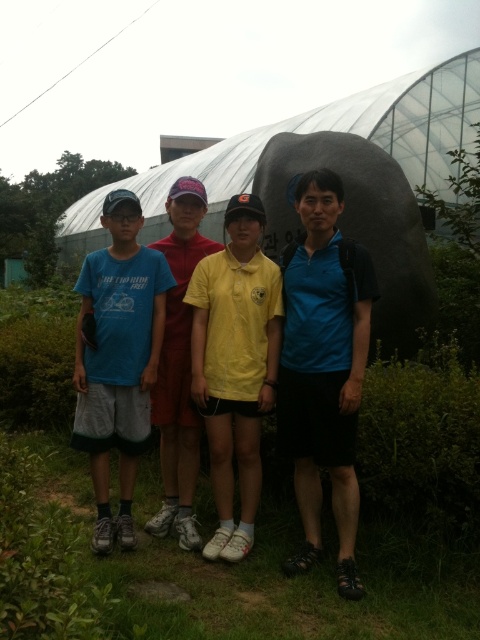
Question: Among these objects, which one is nearest to the camera?

Choices:
 (A) blue fabric shirt at right
 (B) yellow matte shirt at center
 (C) blue cotton t-shirt at left

Answer: (A)

Question: Which of the following is the farthest from the observer?

Choices:
 (A) blue cotton t-shirt at left
 (B) yellow matte shirt at center
 (C) blue fabric shirt at right

Answer: (A)

Question: Observing the image, what is the correct spatial positioning of blue fabric shirt at right in reference to yellow matte shirt at center?

Choices:
 (A) left
 (B) right

Answer: (B)

Question: Observing the image, what is the correct spatial positioning of blue fabric shirt at right in reference to yellow matte shirt at center?

Choices:
 (A) above
 (B) below

Answer: (A)

Question: Does blue fabric shirt at right have a greater width compared to yellow matte shirt at center?

Choices:
 (A) no
 (B) yes

Answer: (A)

Question: Which of these objects is positioned closest to the blue fabric shirt at right?

Choices:
 (A) yellow matte shirt at center
 (B) blue cotton t-shirt at left

Answer: (A)